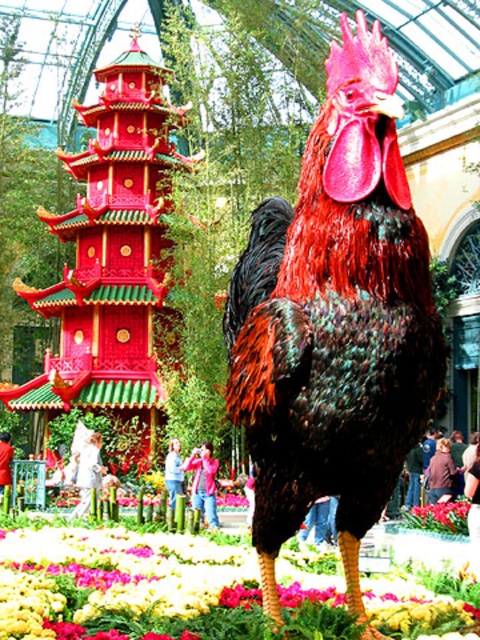
Question: Among these objects, which one is farthest from the camera?

Choices:
 (A) shiny red and black feathers at center
 (B) vivid pink petals at center

Answer: (B)

Question: Is the position of shiny red pagoda at left more distant than that of vivid pink petals at center?

Choices:
 (A) no
 (B) yes

Answer: (B)

Question: From the image, what is the correct spatial relationship of shiny red and black feathers at center in relation to vivid pink petals at center?

Choices:
 (A) left
 (B) right

Answer: (A)

Question: Is the position of multicolored fabric at lower center more distant than that of vivid pink petals at center?

Choices:
 (A) no
 (B) yes

Answer: (A)

Question: Considering the real-world distances, which object is closest to the vivid pink petals at center?

Choices:
 (A) multicolored fabric at lower center
 (B) shiny red pagoda at left

Answer: (A)

Question: Which point is closer to the camera?

Choices:
 (A) vivid pink petals at center
 (B) shiny red and black feathers at center
 (C) multicolored fabric at lower center
 (D) shiny red pagoda at left

Answer: (B)